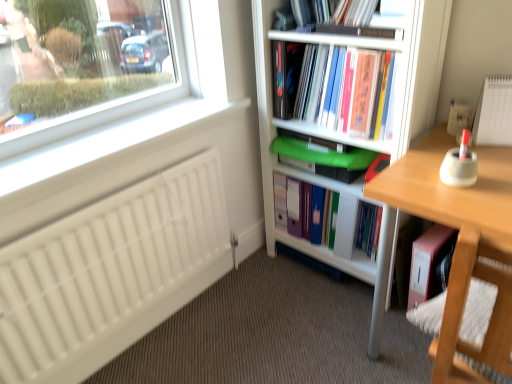
Where is `blank area to the left of matte plastic shelf at center`? blank area to the left of matte plastic shelf at center is located at coordinates 267,281.